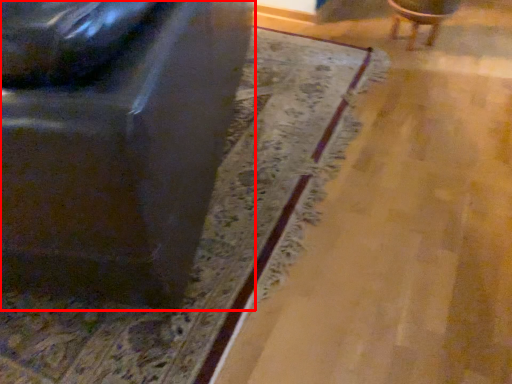
Question: From the image's perspective, considering the relative positions of chair (annotated by the red box) and chair in the image provided, where is chair (annotated by the red box) located with respect to the staircase?

Choices:
 (A) above
 (B) below

Answer: (B)